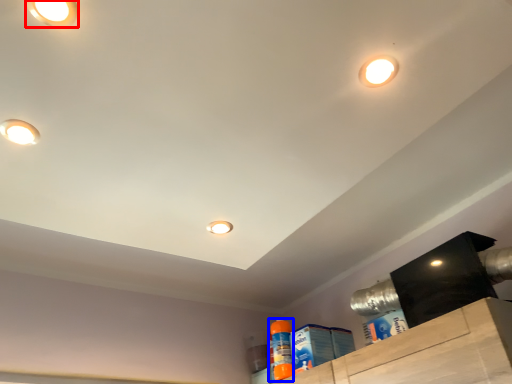
Question: Which object is closer to the camera taking this photo, droplight (highlighted by a red box) or cleaning product (highlighted by a blue box)?

Choices:
 (A) droplight
 (B) cleaning product

Answer: (A)